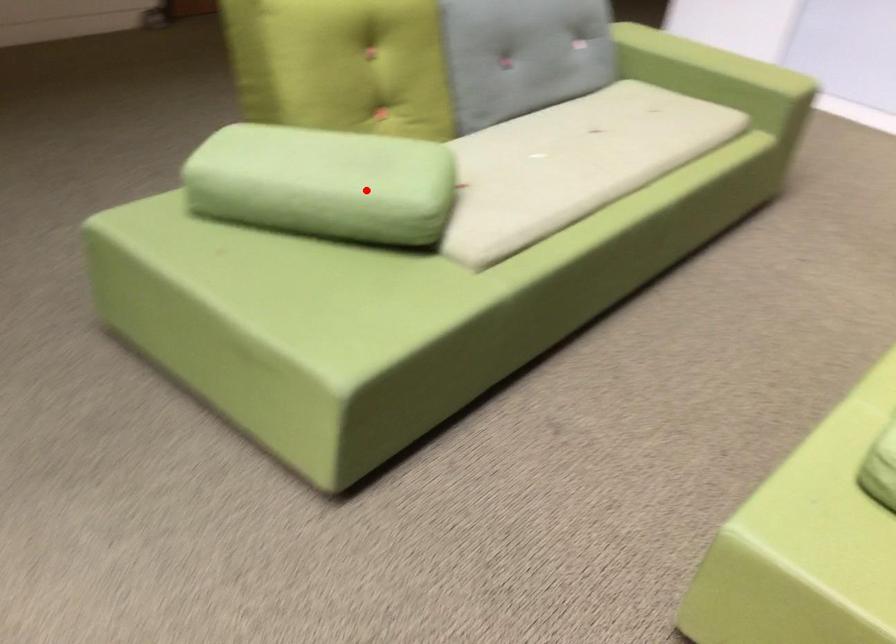
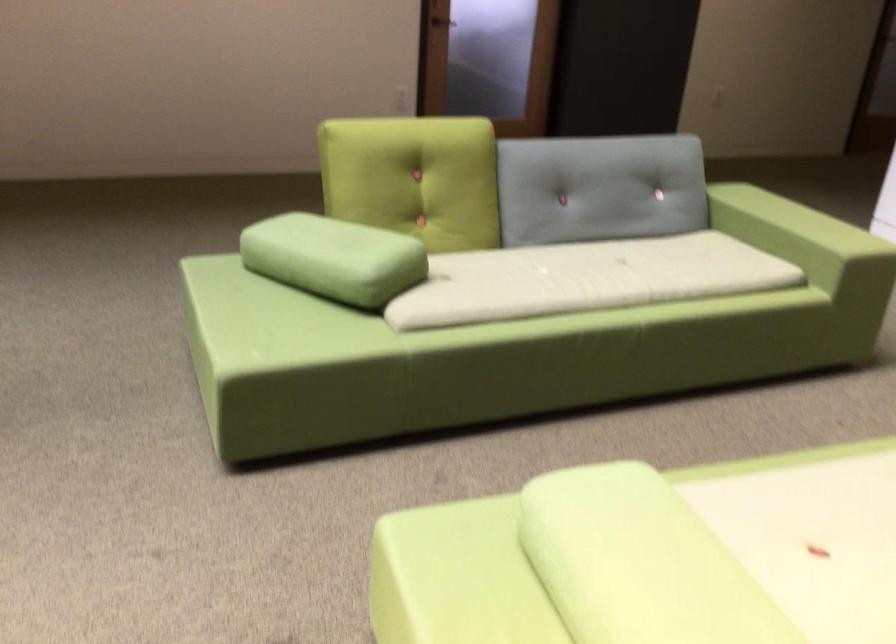
Question: A red point is marked in image1. In image2, is the corresponding 3D point closer to the camera or farther? Reply with the corresponding letter.

Choices:
 (A) The corresponding 3D point is closer.
 (B) The corresponding 3D point is farther.

Answer: (B)